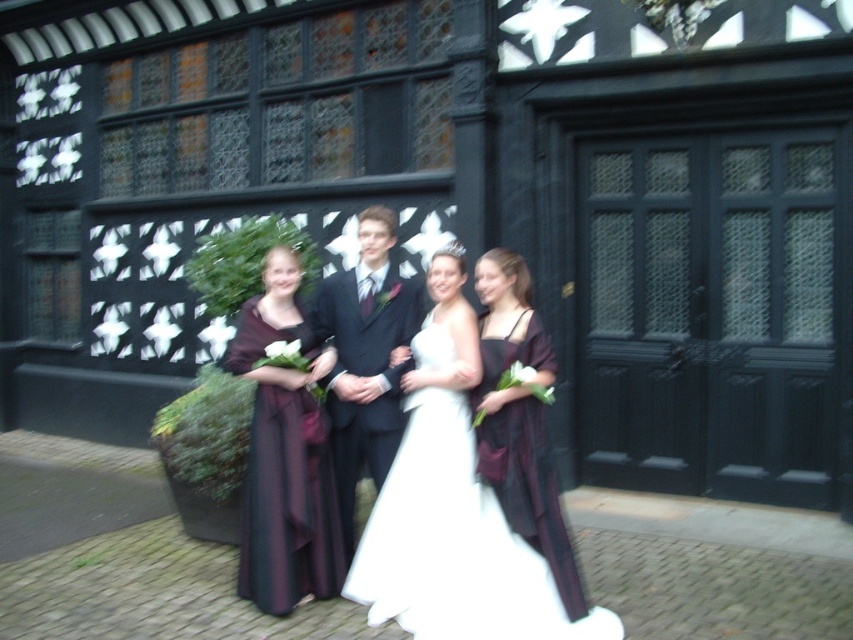
You are a photographer at the wedding and need to capture a shot where both the dark purple satin dress at center and the matte burgundy dress at center are clearly visible. Which dress should you focus on first to ensure both are in focus?

You should focus on the dark purple satin dress at center first because it is closer to the viewer than the matte burgundy dress at center, so adjusting focus from the closer to the farther object will help both be in focus.

You are a photographer at the wedding venue and need to position the white satin dress at center and the black wooden door at center in a photo. The door must be much taller than the dress. Which object should you place higher in the frame to maintain this height relationship?

The black wooden door at center should be placed higher in the frame than the white satin dress at center to maintain its much taller height relationship.